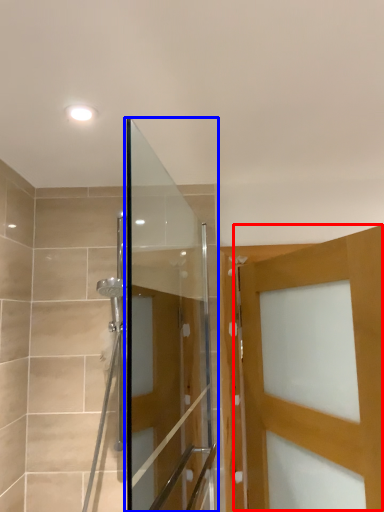
Question: Which object is further to the camera taking this photo, door (highlighted by a red box) or screen door (highlighted by a blue box)?

Choices:
 (A) door
 (B) screen door

Answer: (A)